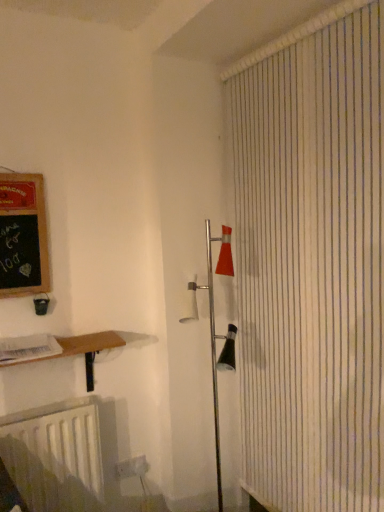
Where is `free location above wooden at lower left (from a real-world perspective)`? Image resolution: width=384 pixels, height=512 pixels. free location above wooden at lower left (from a real-world perspective) is located at coordinates (54, 345).